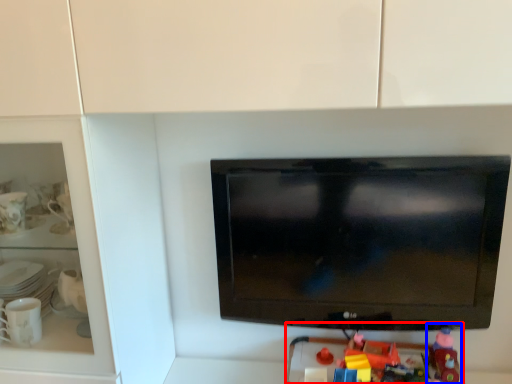
Question: Which object appears farthest to the camera in this image, toy (highlighted by a red box) or toy (highlighted by a blue box)?

Choices:
 (A) toy
 (B) toy

Answer: (B)